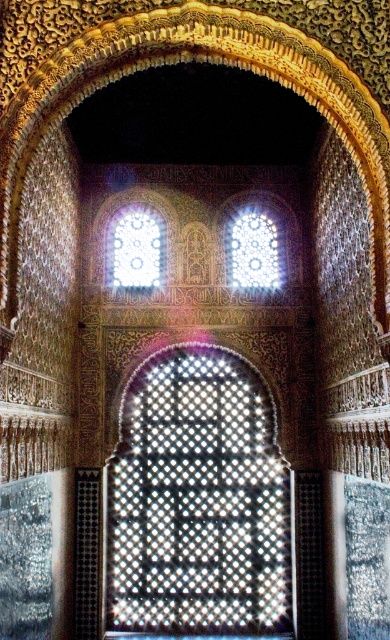
Between transparent glass at upper center and translucent glass window at upper center, which one has less height?

translucent glass window at upper center

Does transparent glass at upper center have a lesser height compared to translucent glass window at upper center?

No, transparent glass at upper center is not shorter than translucent glass window at upper center.

Where is `transparent glass at upper center`? This screenshot has height=640, width=390. transparent glass at upper center is located at coordinates (136, 250).

I want to click on transparent glass at upper center, so click(136, 250).

In order to click on translucent mosaic at center in this screenshot , I will do `click(196, 500)`.

Who is positioned more to the right, translucent mosaic at center or transparent glass at upper center?

From the viewer's perspective, translucent mosaic at center appears more on the right side.

The width and height of the screenshot is (390, 640). What do you see at coordinates (196, 500) in the screenshot?
I see `translucent mosaic at center` at bounding box center [196, 500].

Locate an element on the screen. This screenshot has width=390, height=640. translucent mosaic at center is located at coordinates (196, 500).

Does point (163, 620) come behind point (239, 237)?

No.

Identify the location of translucent mosaic at center. (196, 500).